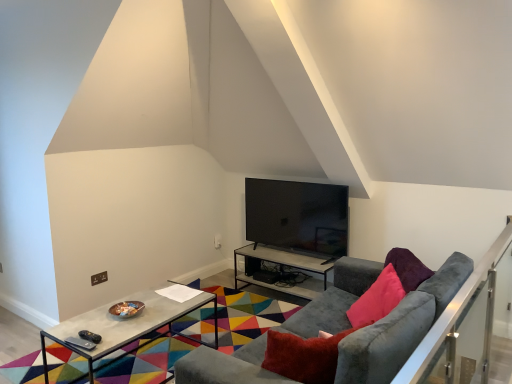
Question: Which direction should I rotate to look at concrete table at center, arranged as the 2th table when viewed from the back?

Choices:
 (A) left
 (B) right

Answer: (A)

Question: Is metallic gray table at center, arranged as the second table when viewed from the front, smaller than concrete table at center, the first table positioned from the left?

Choices:
 (A) no
 (B) yes

Answer: (B)

Question: From the image's perspective, is metallic gray table at center, arranged as the second table when viewed from the front, on top of concrete table at center, the first table positioned from the left?

Choices:
 (A) no
 (B) yes

Answer: (B)

Question: Is metallic gray table at center, arranged as the second table when viewed from the front, in front of concrete table at center, the first table positioned from the left?

Choices:
 (A) yes
 (B) no

Answer: (B)

Question: Is metallic gray table at center, arranged as the second table when viewed from the front, oriented away from concrete table at center, arranged as the 2th table when viewed from the back?

Choices:
 (A) no
 (B) yes

Answer: (A)

Question: From a real-world perspective, does metallic gray table at center, arranged as the second table when viewed from the front, sit lower than concrete table at center, the first table positioned from the left?

Choices:
 (A) yes
 (B) no

Answer: (A)

Question: Is metallic gray table at center, placed as the 2th table when sorted from left to right, further to the viewer compared to concrete table at center, arranged as the 2th table when viewed from the back?

Choices:
 (A) yes
 (B) no

Answer: (A)

Question: From the image's perspective, would you say satin silver balustrade at right is positioned over velvet grey couch at center?

Choices:
 (A) yes
 (B) no

Answer: (A)

Question: Is satin silver balustrade at right taller than velvet grey couch at center?

Choices:
 (A) no
 (B) yes

Answer: (B)

Question: Would you consider satin silver balustrade at right to be distant from velvet grey couch at center?

Choices:
 (A) no
 (B) yes

Answer: (A)

Question: Considering the relative sizes of satin silver balustrade at right and velvet grey couch at center in the image provided, is satin silver balustrade at right thinner than velvet grey couch at center?

Choices:
 (A) yes
 (B) no

Answer: (A)

Question: Considering the relative sizes of satin silver balustrade at right and velvet grey couch at center in the image provided, is satin silver balustrade at right wider than velvet grey couch at center?

Choices:
 (A) no
 (B) yes

Answer: (A)

Question: Is velvet grey couch at center at the back of satin silver balustrade at right?

Choices:
 (A) yes
 (B) no

Answer: (A)

Question: Can you confirm if black glossy tv at center is smaller than concrete table at center, the first table positioned from the left?

Choices:
 (A) no
 (B) yes

Answer: (B)